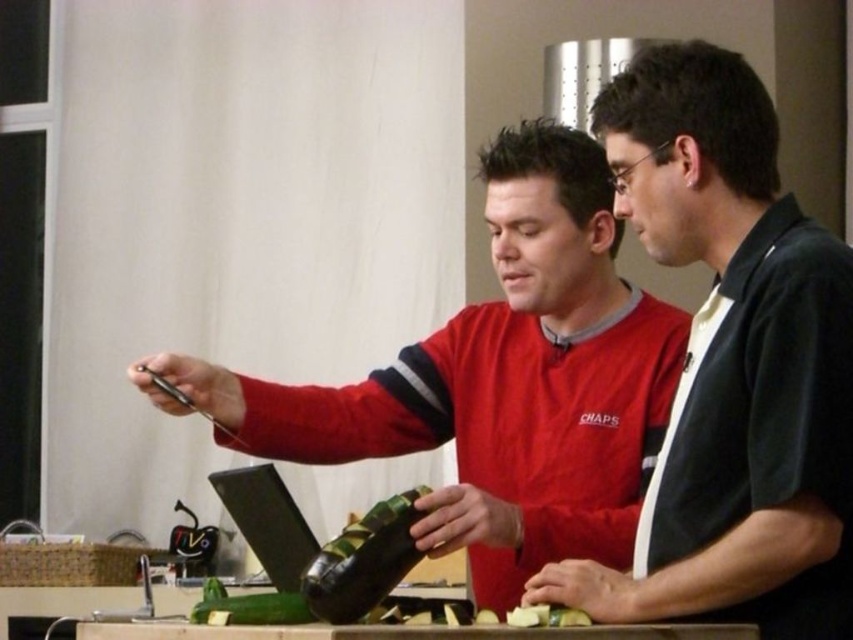
Question: Among these points, which one is nearest to the camera?

Choices:
 (A) (428, 488)
 (B) (566, 609)
 (C) (741, 611)

Answer: (C)

Question: Is black matte shirt at center positioned at the back of green matte cucumber at center?

Choices:
 (A) yes
 (B) no

Answer: (B)

Question: Which point is farther to the camera?

Choices:
 (A) (642, 396)
 (B) (712, 150)
 (C) (573, 624)
 (D) (352, 556)

Answer: (A)

Question: Can you confirm if black matte shirt at center is positioned above green matte bottle at center?

Choices:
 (A) yes
 (B) no

Answer: (A)

Question: Among these objects, which one is nearest to the camera?

Choices:
 (A) red fabric shirt at center
 (B) green matte cucumber at center
 (C) green matte bottle at center
 (D) black matte shirt at center

Answer: (D)

Question: Can you confirm if green matte bottle at center is wider than green matte cucumber at center?

Choices:
 (A) yes
 (B) no

Answer: (B)